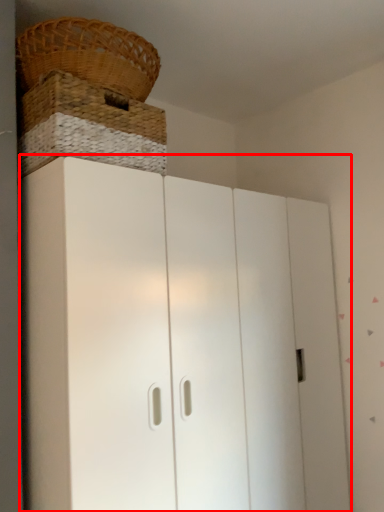
Question: From the image's perspective, where is cupboard (annotated by the red box) located in relation to basket in the image?

Choices:
 (A) below
 (B) above

Answer: (A)